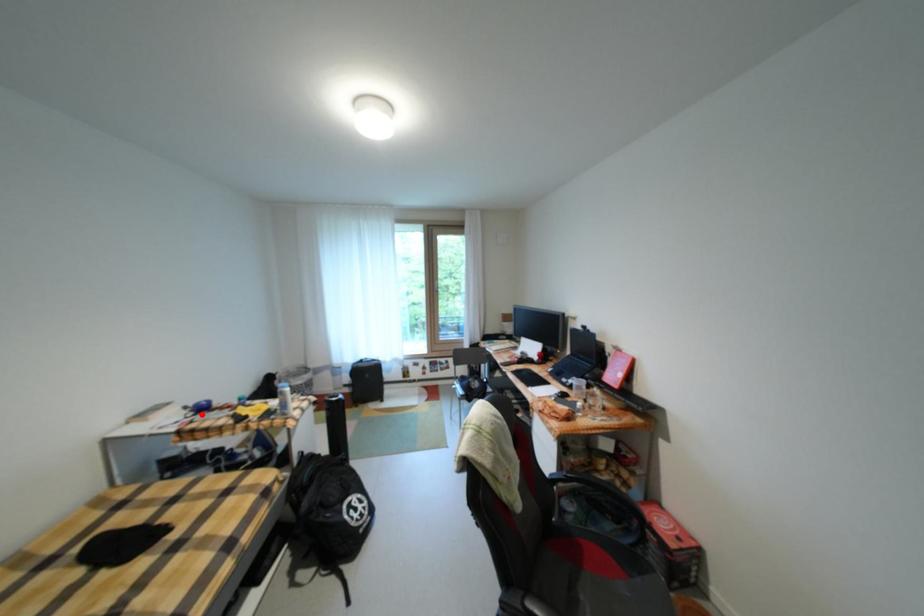
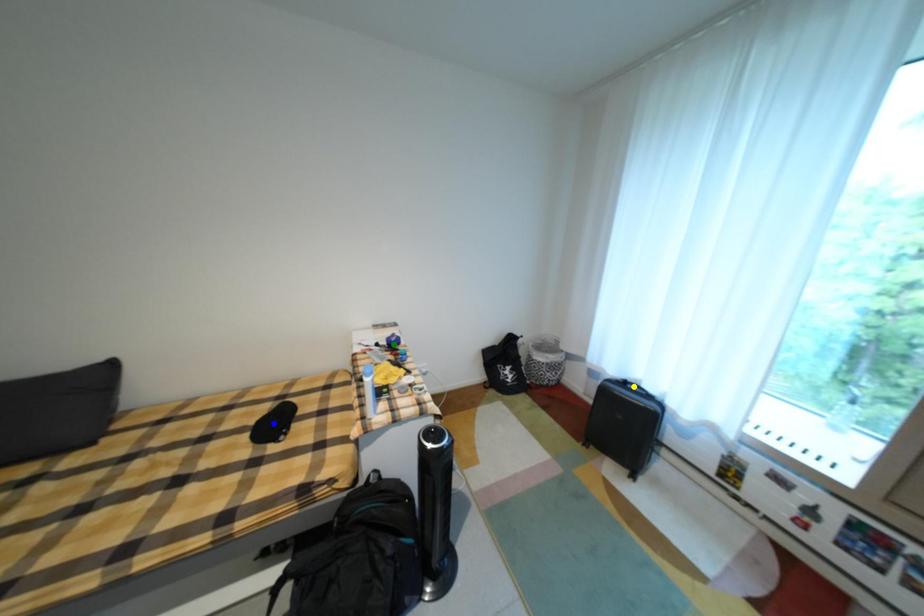
Question: I am providing you with two images of the same scene from different viewpoints. A red point is marked on the first image. You are given multiple points on the second image. Which point in image 2 is actually the same real-world point as the red point in image 1?

Choices:
 (A) yellow point
 (B) blue point
 (C) green point

Answer: (C)